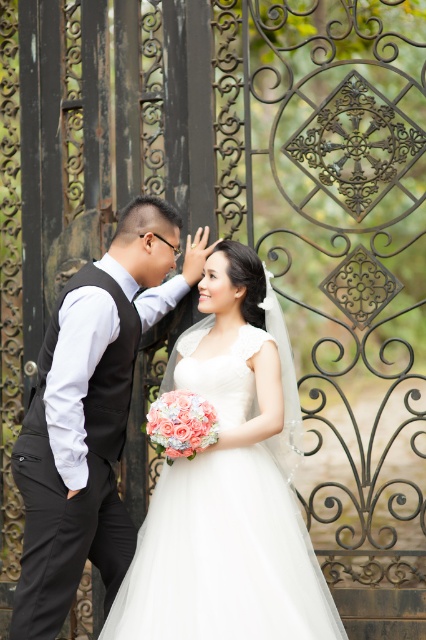
You are a photographer at a wedding and need to position the couple so that the white satin dress at center and the black satin vest at left are both visible in the frame. Based on their current positions, which direction should the couple move to ensure both outfits are fully visible?

The white satin dress at center is to the right of the black satin vest at left, so the couple should move slightly to the left to ensure both the white satin dress at center and the black satin vest at left are fully visible in the frame.

You are a photographer at a wedding. You need to capture a photo where the white satin dress at center and the black satin vest at left are both clearly visible. Based on their positions, which one is closer to the camera?

The white satin dress at center is positioned under the black satin vest at left, meaning it is closer to the camera. Therefore, the white satin dress at center will appear larger in the photo compared to the black satin vest at left.